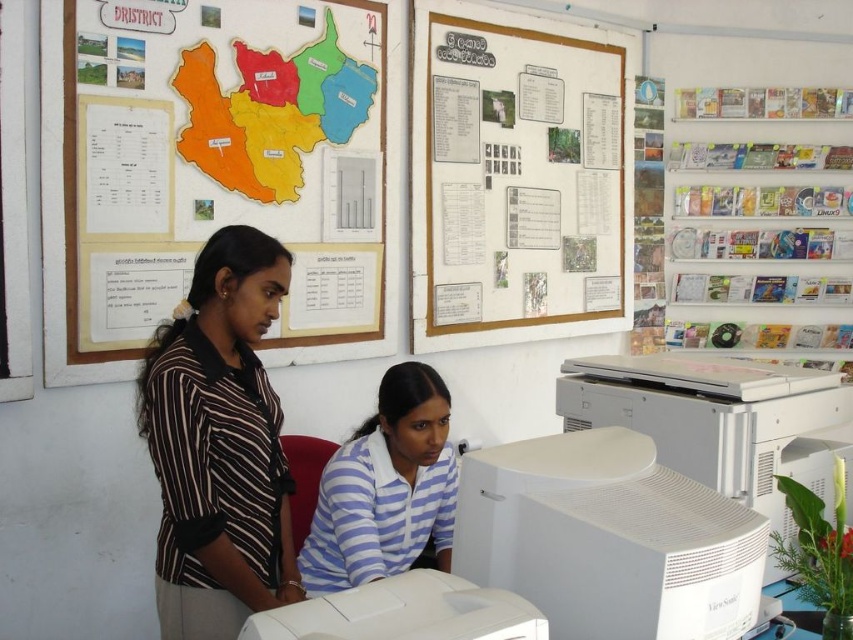
You are a visitor in this office and need to locate the white plastic computer monitor at center. Based on the scene description, where would you expect to find the blue striped shirt at center in relation to the monitor?

The blue striped shirt at center is below the white plastic computer monitor at center, so you would find the blue striped shirt at center positioned lower than the monitor.

You are a delivery person who needs to place a 12 inch wide package between the white matte computer monitor at lower center and the white plastic computer monitor at center. Can you fit it there?

The distance between the white matte computer monitor at lower center and the white plastic computer monitor at center is 10.85 inches, which is less than the 12 inch width of the package. Therefore, the package cannot be placed between them.